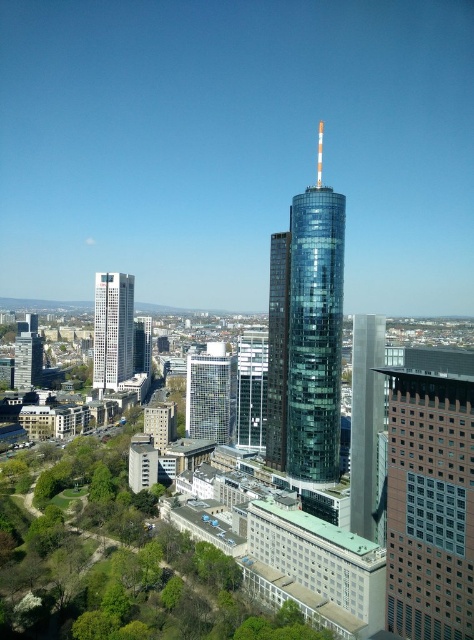
Question: Which is farther from the glassy steel skyscraper at center?

Choices:
 (A) white glass tower at left
 (B) clear glass building at center

Answer: (A)

Question: Which of the following is the farthest from the observer?

Choices:
 (A) (103, 321)
 (B) (211, 360)
 (C) (325, 221)

Answer: (A)

Question: Does transparent glass tower at center appear under glassy steel skyscraper at center?

Choices:
 (A) yes
 (B) no

Answer: (B)

Question: Among these points, which one is farthest from the camera?

Choices:
 (A) (213, 372)
 (B) (124, 285)
 (C) (381, 426)
 (D) (283, 376)

Answer: (B)

Question: In this image, where is glassy steel skyscraper at center located relative to clear glass building at center?

Choices:
 (A) above
 (B) below

Answer: (A)

Question: Is transparent glass tower at center wider than glassy steel skyscraper at center?

Choices:
 (A) no
 (B) yes

Answer: (B)